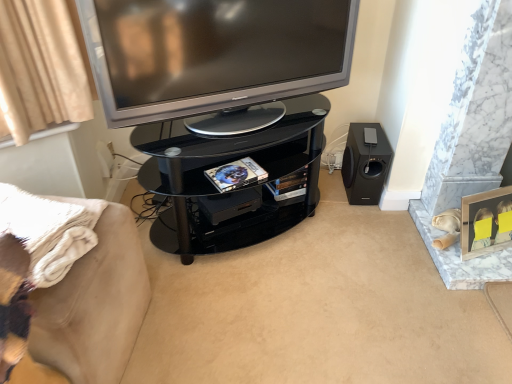
The height and width of the screenshot is (384, 512). Find the location of `vacant space in front of black matte speaker at lower right`. vacant space in front of black matte speaker at lower right is located at coordinates (367, 217).